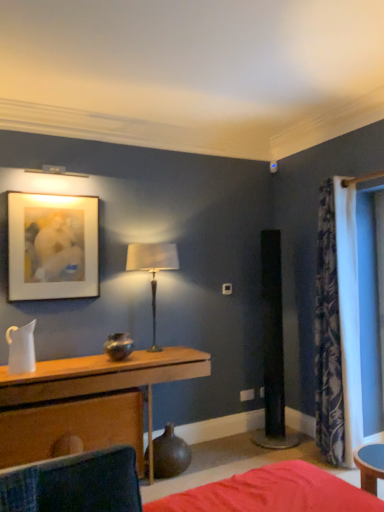
Question: Does wooden table at center have a greater height compared to floral fabric curtain at right?

Choices:
 (A) no
 (B) yes

Answer: (A)

Question: From a real-world perspective, does wooden table at center stand above floral fabric curtain at right?

Choices:
 (A) no
 (B) yes

Answer: (A)

Question: Does wooden table at center have a greater width compared to floral fabric curtain at right?

Choices:
 (A) no
 (B) yes

Answer: (B)

Question: Is wooden table at center at the left side of floral fabric curtain at right?

Choices:
 (A) no
 (B) yes

Answer: (B)

Question: Could you tell me if wooden table at center is facing floral fabric curtain at right?

Choices:
 (A) no
 (B) yes

Answer: (A)

Question: In terms of height, does wooden table at center look taller or shorter compared to matte brown vase at lower center?

Choices:
 (A) tall
 (B) short

Answer: (A)

Question: Considering the positions of wooden table at center and matte brown vase at lower center in the image, is wooden table at center wider or thinner than matte brown vase at lower center?

Choices:
 (A) wide
 (B) thin

Answer: (A)

Question: Relative to matte brown vase at lower center, is wooden table at center in front or behind?

Choices:
 (A) behind
 (B) front

Answer: (B)

Question: Is wooden table at center situated inside matte brown vase at lower center or outside?

Choices:
 (A) inside
 (B) outside

Answer: (B)

Question: Considering the positions of metallic silver table lamp at center and floral fabric curtain at right in the image, is metallic silver table lamp at center taller or shorter than floral fabric curtain at right?

Choices:
 (A) tall
 (B) short

Answer: (B)

Question: Is metallic silver table lamp at center spatially inside floral fabric curtain at right, or outside of it?

Choices:
 (A) inside
 (B) outside

Answer: (B)

Question: Is point (163, 265) positioned closer to the camera than point (332, 460)?

Choices:
 (A) closer
 (B) farther

Answer: (B)

Question: Is metallic silver table lamp at center wider or thinner than floral fabric curtain at right?

Choices:
 (A) thin
 (B) wide

Answer: (A)

Question: From the image's perspective, is matte brown vase at lower center located above or below red fabric bed at lower center?

Choices:
 (A) above
 (B) below

Answer: (A)

Question: Looking at their shapes, would you say matte brown vase at lower center is wider or thinner than red fabric bed at lower center?

Choices:
 (A) wide
 (B) thin

Answer: (B)